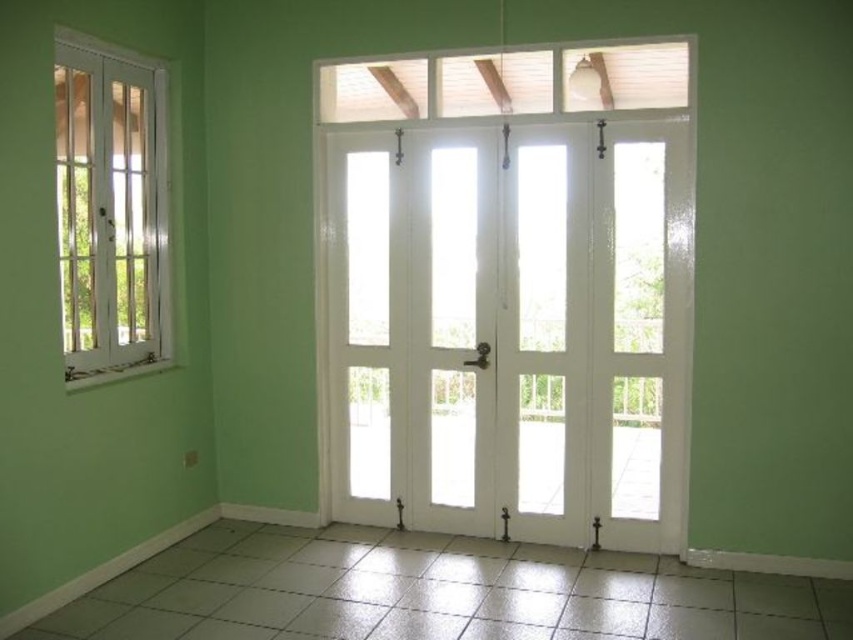
Question: Observing the image, what is the correct spatial positioning of white glass door at center in reference to white glass window at left?

Choices:
 (A) below
 (B) above

Answer: (A)

Question: Does white glass door at center have a smaller size compared to white glass window at left?

Choices:
 (A) yes
 (B) no

Answer: (B)

Question: Which point appears closest to the camera in this image?

Choices:
 (A) (138, 90)
 (B) (456, 522)

Answer: (A)

Question: Is white glass door at center thinner than white glass window at left?

Choices:
 (A) yes
 (B) no

Answer: (B)

Question: Which point is closer to the camera?

Choices:
 (A) (389, 356)
 (B) (112, 248)

Answer: (B)